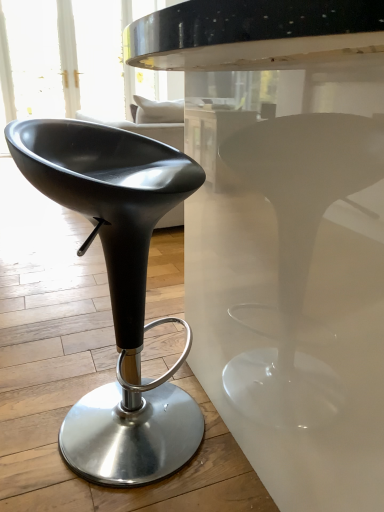
What do you see at coordinates (118, 290) in the screenshot? This screenshot has height=512, width=384. I see `matte black stool at left` at bounding box center [118, 290].

Identify the location of matte black stool at left. (118, 290).

In order to face matte black stool at left, should I rotate leftwards or rightwards?

Turn left approximately 9.103 degrees to face it.

You are a GUI agent. You are given a task and a screenshot of the screen. Output one action in this format:
    pyautogui.click(x=<x>, y=<y>)
    Task: Click on the matte black stool at left
    This screenshot has width=384, height=512.
    Given the screenshot: What is the action you would take?
    pyautogui.click(x=118, y=290)